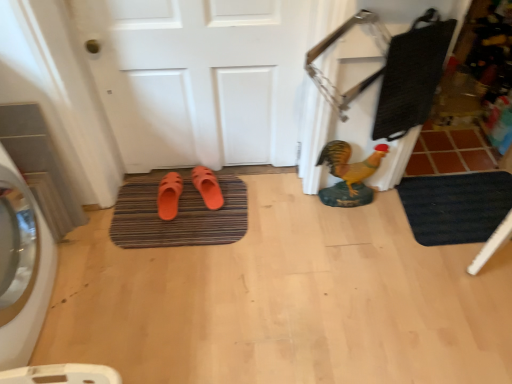
Locate an element on the screen. free location in front of brown textured bath mat at center, marked as the first bath mat in a left-to-right arrangement is located at coordinates pyautogui.click(x=166, y=302).